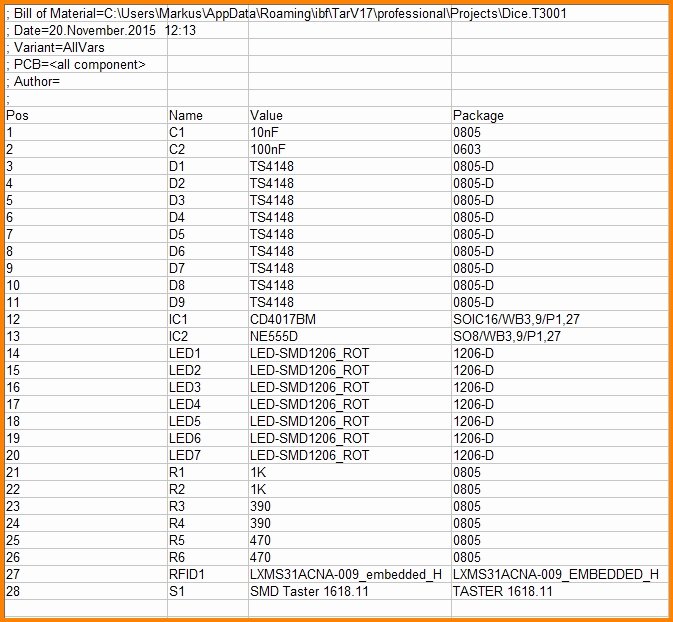
Identify the location of columns. Image resolution: width=673 pixels, height=622 pixels. (108, 12), (186, 17), (274, 15), (478, 12).